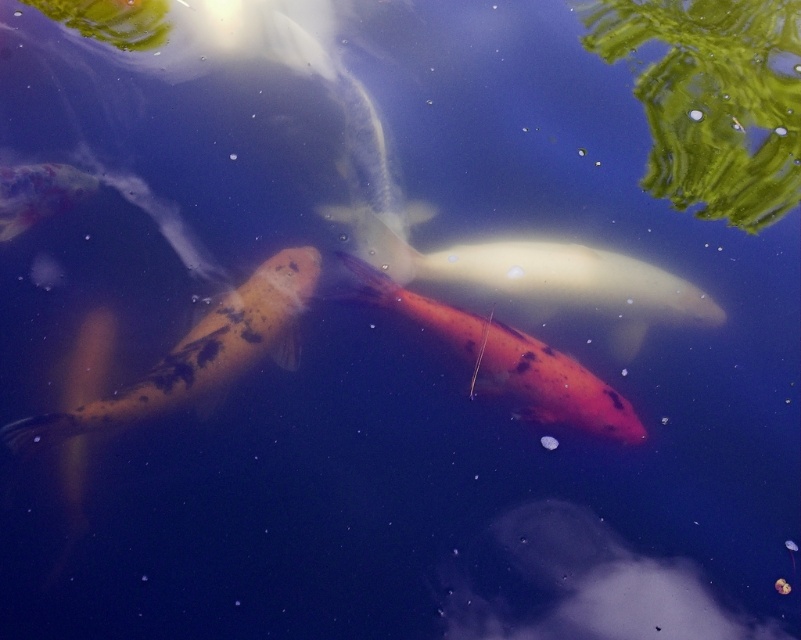
You are a photographer aiming to capture both the speckled orange goldfish at center and the orange matte goldfish at center in a single frame. Given that your camera lens has a maximum focus range of 50 centimeters, will you be able to capture both fish clearly in the photo?

The speckled orange goldfish at center and orange matte goldfish at center are 56.35 centimeters apart. Since the distance between them exceeds the camera lens maximum focus range of 50 centimeters, you cannot capture both fish clearly in the same frame.

You are a photographer trying to capture a clear shot of the speckled orange goldfish at center and the orange matte goldfish at center. Given that your camera can only focus on one fish at a time, which fish should you choose to ensure the larger one is in focus?

The speckled orange goldfish at center is larger in size than the orange matte goldfish at center, so you should focus on the speckled orange goldfish at center to ensure the larger one is in focus.